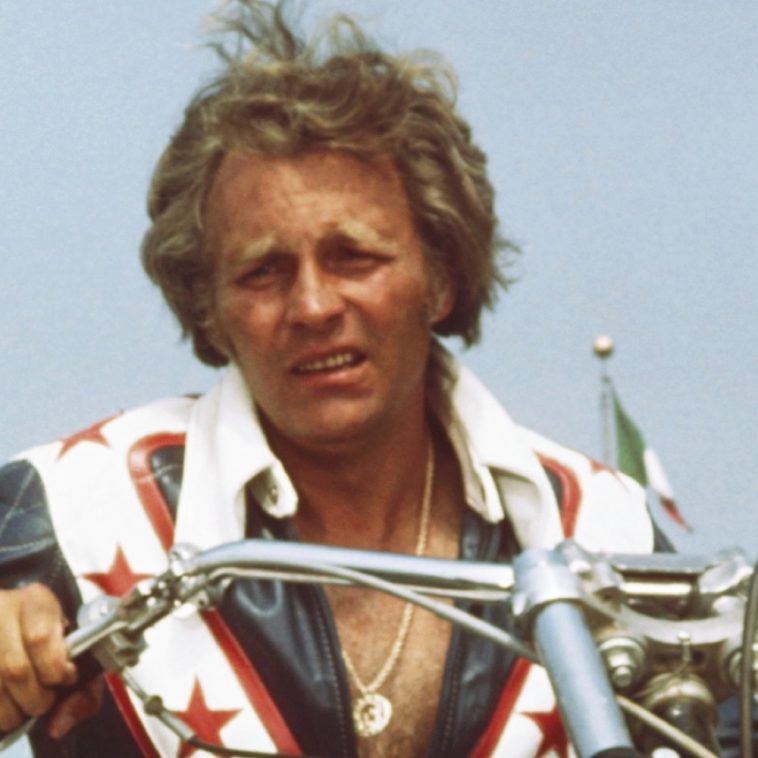
You are a GUI agent. You are given a task and a screenshot of the screen. Output one action in this format:
    pyautogui.click(x=<x>, y=<y>)
    Task: Click on the silver handle
    The width and height of the screenshot is (758, 758).
    Given the screenshot: What is the action you would take?
    pyautogui.click(x=565, y=649), pyautogui.click(x=104, y=630), pyautogui.click(x=356, y=562), pyautogui.click(x=684, y=564)